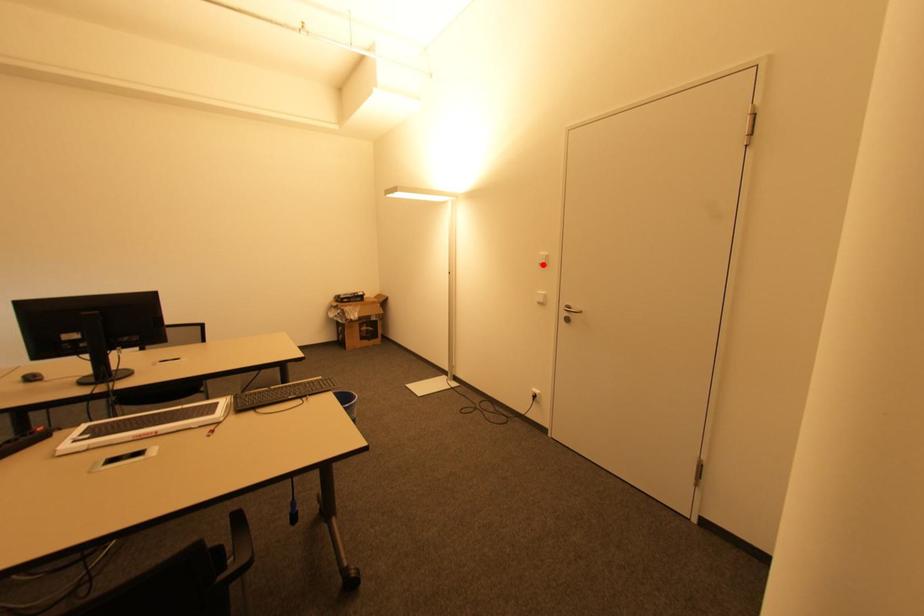
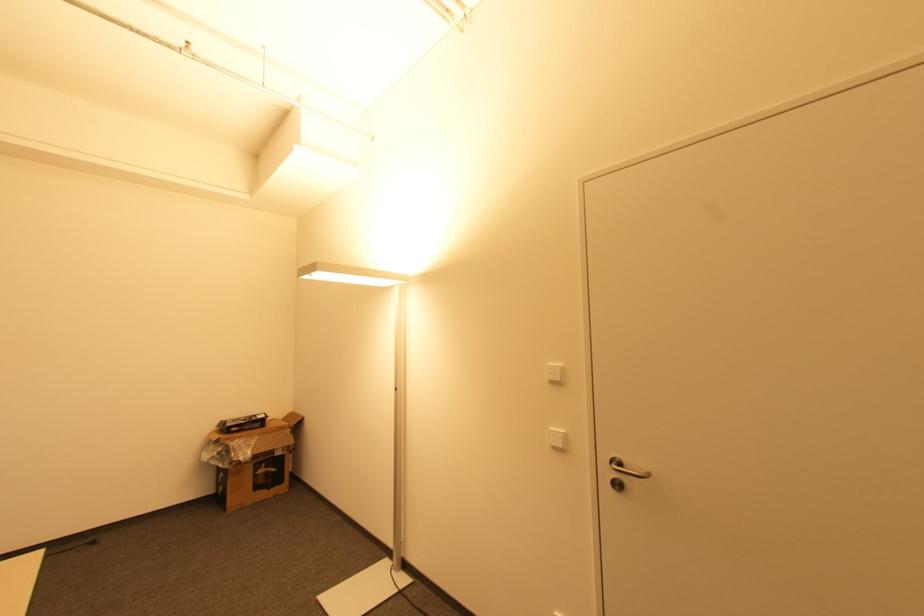
Where in the second image is the point corresponding to the highlighted location from the first image?

(554, 383)